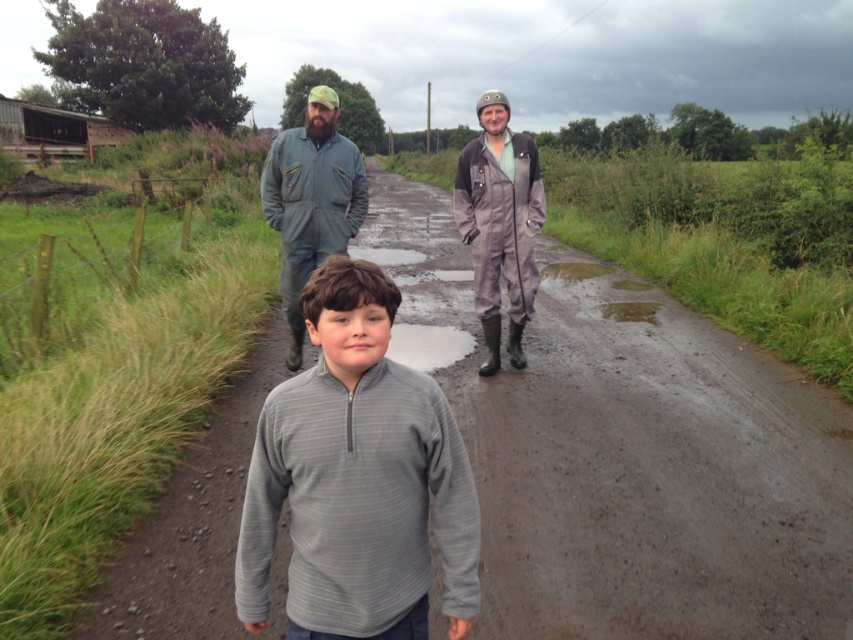
You are standing at the camera position and want to throw a ball to the green fabric jumpsuit at center. Can you reach them with a throw of 4 meters?

The distance between the green fabric jumpsuit at center and the camera is 4.18 meters, so a throw of 4 meters would not be enough to reach them.

You are a photographer trying to capture a group photo of the gray fleece at center and the gray matte coveralls at center. Since you want both subjects to appear in the frame, which one should you focus on first to ensure they are both in focus?

The gray fleece at center is taller than the gray matte coveralls at center, so you should focus on the gray fleece at center first to ensure both are in focus.